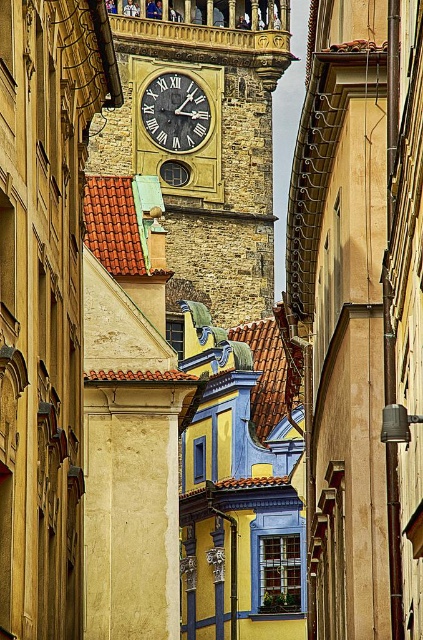
Question: Can you confirm if stone clock tower at center is thinner than gold/yellow metal clock at center?

Choices:
 (A) yes
 (B) no

Answer: (B)

Question: Which point is closer to the camera?

Choices:
 (A) (161, 96)
 (B) (228, 300)

Answer: (B)

Question: Which point appears farthest from the camera in this image?

Choices:
 (A) click(x=175, y=44)
 (B) click(x=198, y=113)

Answer: (B)

Question: Does stone clock tower at center appear on the right side of gold/yellow metal clock at center?

Choices:
 (A) yes
 (B) no

Answer: (A)

Question: Does stone clock tower at center have a larger size compared to gold/yellow metal clock at center?

Choices:
 (A) yes
 (B) no

Answer: (A)